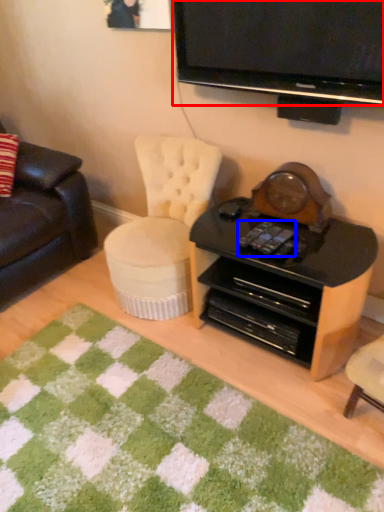
Question: Which of the following is the farthest to the observer, television (highlighted by a red box) or remote control (highlighted by a blue box)?

Choices:
 (A) television
 (B) remote control

Answer: (B)